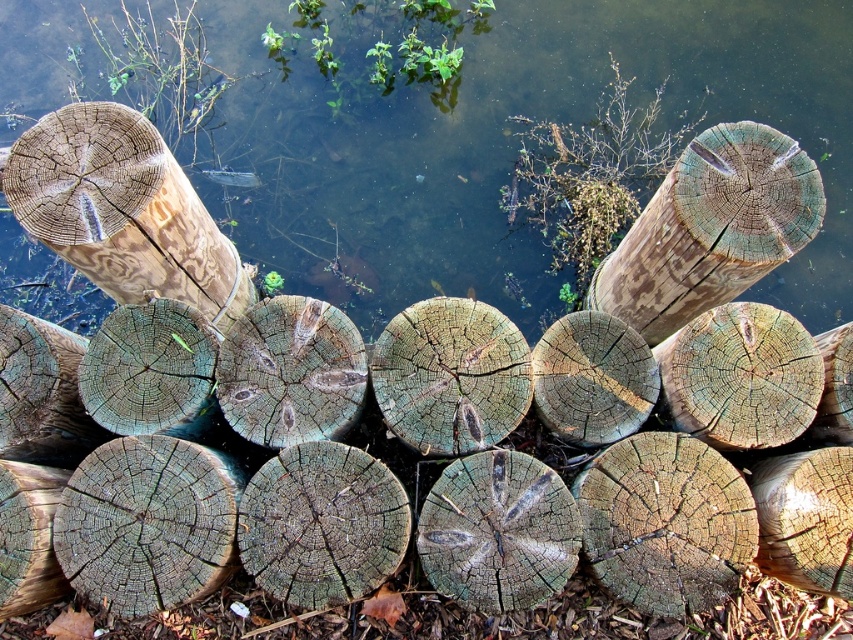
Question: Is weathered wood log at left positioned behind greenish-brown wood at center?

Choices:
 (A) no
 (B) yes

Answer: (B)

Question: Which object is the closest to the greenish-brown wood at center?

Choices:
 (A) greenish-brown water at center
 (B) weathered wood log at left
 (C) weathered wood at upper right

Answer: (C)

Question: Which object is positioned closest to the weathered wood at upper right?

Choices:
 (A) greenish-brown water at center
 (B) weathered wood log at left
 (C) greenish-brown wood at center

Answer: (A)

Question: Which object appears closest to the camera in this image?

Choices:
 (A) weathered wood at upper right
 (B) greenish-brown water at center

Answer: (A)

Question: Is the position of greenish-brown water at center more distant than that of greenish-brown wood at center?

Choices:
 (A) yes
 (B) no

Answer: (A)

Question: Can you confirm if weathered wood log at left is wider than greenish-brown wood at center?

Choices:
 (A) no
 (B) yes

Answer: (B)